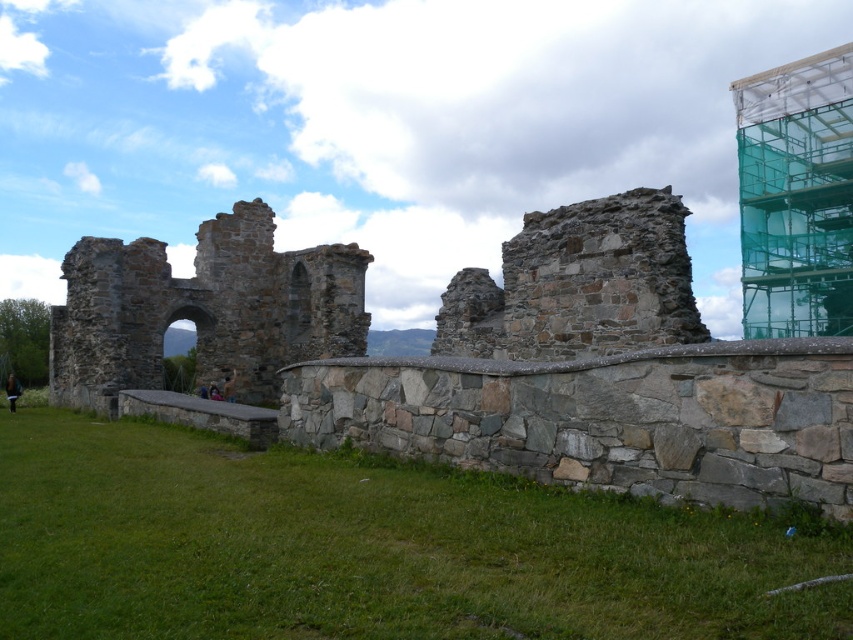
Measure the distance between stone wall at center and stone arch at center.

A distance of 4.16 meters exists between stone wall at center and stone arch at center.

Can you confirm if stone wall at center is wider than stone arch at center?

Yes.

Who is more distant from viewer, [320,307] or [109,394]?

The point [320,307] is more distant.

Locate an element on the screen. This screenshot has height=640, width=853. stone wall at center is located at coordinates (485, 356).

Is stone arch at center closer to the viewer compared to green mesh scaffolding at upper right?

Yes, it is in front of green mesh scaffolding at upper right.

Is point (204, 371) positioned in front of point (749, 170)?

Yes, point (204, 371) is closer to viewer.

Based on the photo, who is more distant from viewer, (254, 259) or (798, 128)?

The point (798, 128) is behind.

The image size is (853, 640). I want to click on stone arch at center, so click(202, 310).

Does stone wall at center appear over green mesh scaffolding at upper right?

No.

Which is in front, point (318, 248) or point (761, 182)?

Point (318, 248) is in front.

Is point (306, 349) less distant than point (834, 72)?

Yes, it is.

Find the location of a particular element. stone wall at center is located at coordinates (485, 356).